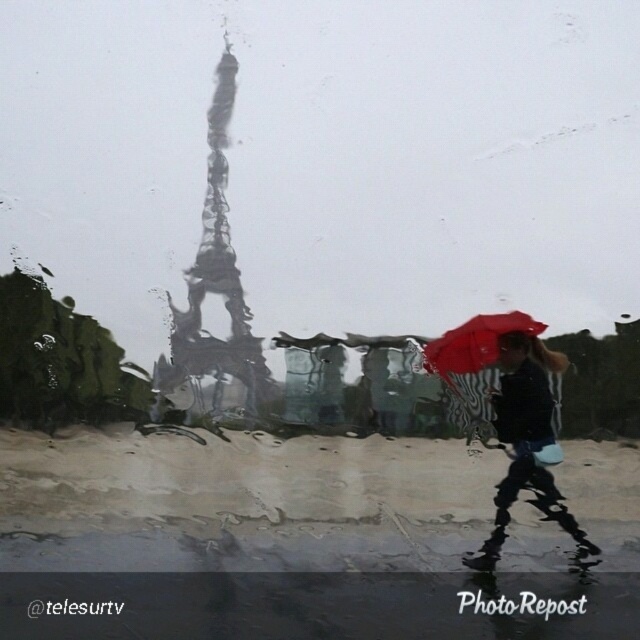
Between point (531, 417) and point (500, 321), which one is positioned in front?

Point (531, 417) is more forward.

Between point (554, 355) and point (465, 337), which one is positioned behind?

Positioned behind is point (465, 337).

The height and width of the screenshot is (640, 640). What are the coordinates of `matte black umbrella at right` in the screenshot? It's located at (525, 442).

Which is more to the left, metallic silver eiffel tower at center or red matte umbrella at center?

From the viewer's perspective, metallic silver eiffel tower at center appears more on the left side.

Measure the distance between metallic silver eiffel tower at center and camera.

metallic silver eiffel tower at center is 1.90 meters away from camera.

Between point (218, 372) and point (490, 364), which one is positioned behind?

Point (218, 372)

What are the coordinates of `metallic silver eiffel tower at center` in the screenshot? It's located at (216, 273).

Can you confirm if metallic silver eiffel tower at center is positioned above matte black umbrella at right?

Yes, metallic silver eiffel tower at center is above matte black umbrella at right.

Who is more distant from viewer, (193, 371) or (492, 394)?

Positioned behind is point (193, 371).

Find the location of `metallic silver eiffel tower at center`. metallic silver eiffel tower at center is located at coordinates (216, 273).